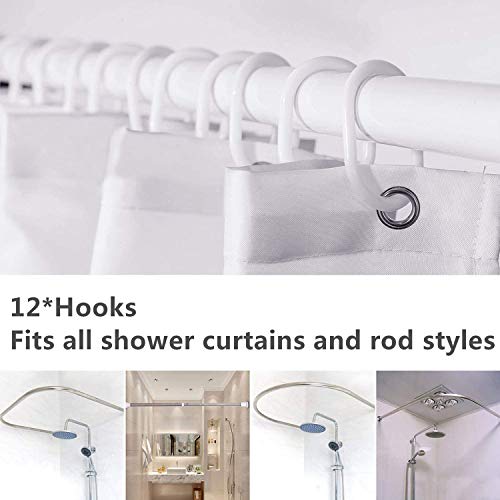
This screenshot has height=500, width=500. I want to click on hook, so click(x=353, y=182).